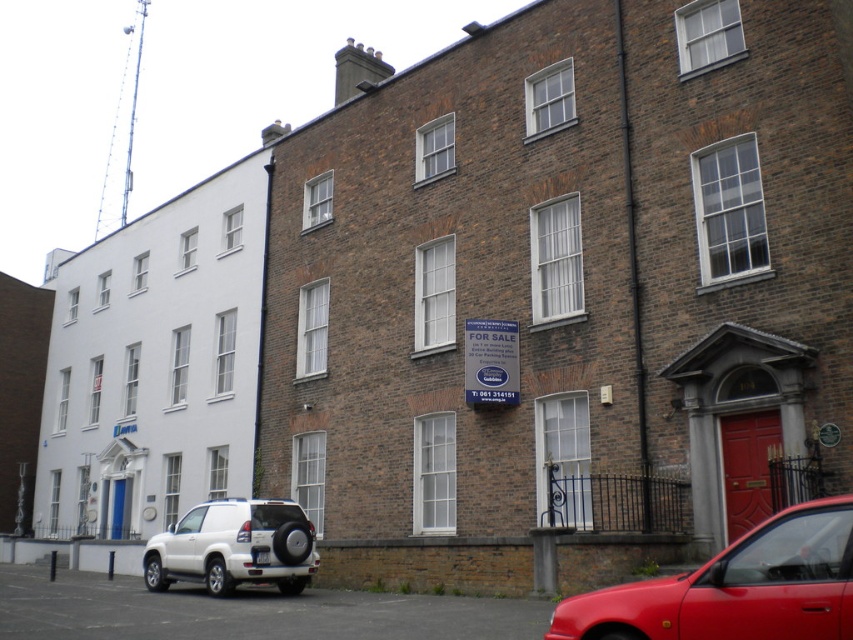
From the picture: You are a delivery driver who needs to park your vehicle in the parking lot behind the two buildings. You see the shiny red car at lower right and the white plastic license plate at center. Which object is closer to the entrance of the white building with the blue door?

The shiny red car at lower right is above the white plastic license plate at center, so the white plastic license plate at center is closer to the entrance of the white building with the blue door.

You are standing in front of the two buildings and see a point marked at coordinate [735,588]. What object does this point correspond to?

The point corresponds to the shiny red car at lower right.

You are a delivery driver who needs to park your vehicle, which is 3 meters long, between the white matte suv at lower left and the white plastic license plate at center. Is there enough space for your vehicle?

The white matte suv at lower left is 3.28 meters away from the white plastic license plate at center. Since your vehicle is 3 meters long, there is enough space to park between them.